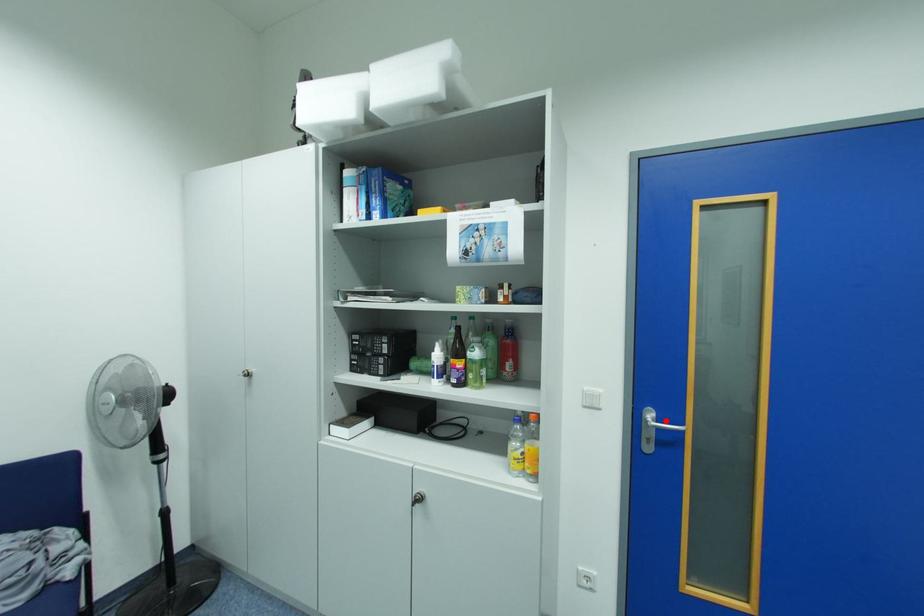
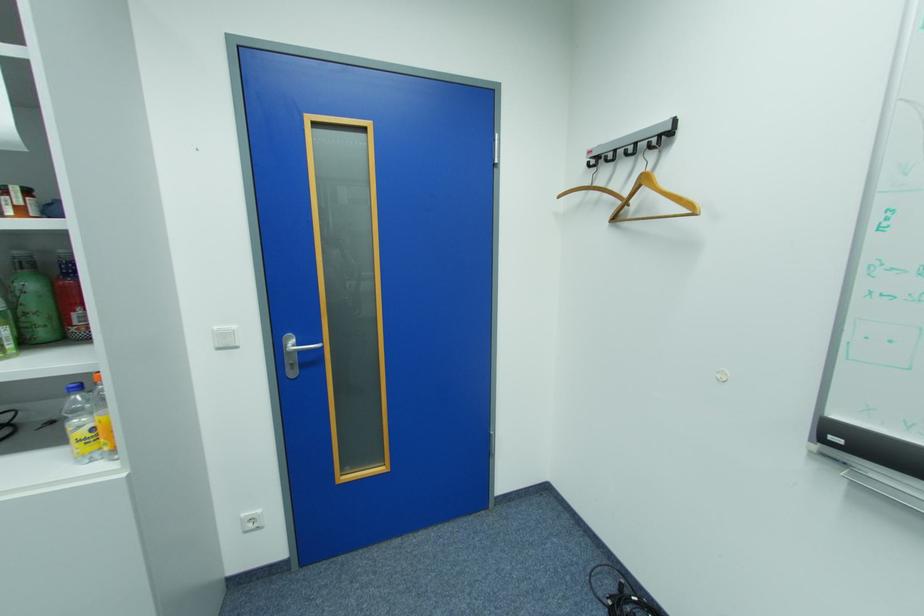
The point at the highlighted location is marked in the first image. Where is the corresponding point in the second image?

(307, 344)